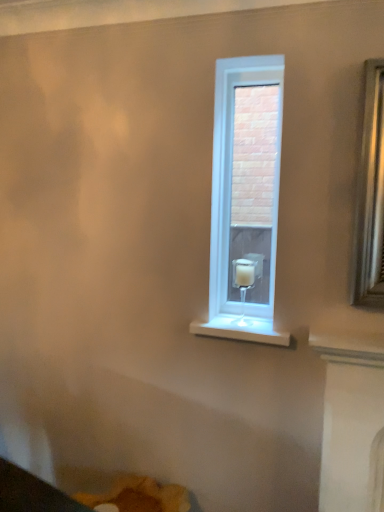
The height and width of the screenshot is (512, 384). What do you see at coordinates (245, 199) in the screenshot?
I see `white glass window at center` at bounding box center [245, 199].

Locate an element on the screen. The height and width of the screenshot is (512, 384). white glass window at center is located at coordinates (245, 199).

What do you see at coordinates (243, 284) in the screenshot? I see `white glass candle holder at center` at bounding box center [243, 284].

Locate an element on the screen. This screenshot has height=512, width=384. white glass candle holder at center is located at coordinates (243, 284).

What is the approximate height of white glass candle holder at center?

It is 10.20 inches.

Locate an element on the screen. Image resolution: width=384 pixels, height=512 pixels. white glass window at center is located at coordinates (245, 199).

Can you confirm if white glass candle holder at center is positioned to the left of white glass window at center?

Indeed, white glass candle holder at center is positioned on the left side of white glass window at center.

From the picture: Considering their positions, is white glass candle holder at center located in front of or behind white glass window at center?

white glass candle holder at center is in front of white glass window at center.

Between point (241, 305) and point (272, 282), which one is positioned behind?

The point (241, 305) is farther from the camera.

From the image's perspective, relative to white glass window at center, is white glass candle holder at center above or below?

Clearly, from the image's perspective, white glass candle holder at center is below white glass window at center.

From a real-world perspective, is white glass candle holder at center positioned under white glass window at center based on gravity?

Yes, from a real-world perspective, white glass candle holder at center is below white glass window at center.

Looking at this image, considering the relative sizes of white glass candle holder at center and white glass window at center in the image provided, is white glass candle holder at center wider than white glass window at center?

Indeed, white glass candle holder at center has a greater width compared to white glass window at center.

Is white glass candle holder at center shorter than white glass window at center?

Yes, white glass candle holder at center is shorter than white glass window at center.

Considering the relative sizes of white glass candle holder at center and white glass window at center in the image provided, is white glass candle holder at center smaller than white glass window at center?

Yes.

Can we say white glass candle holder at center lies outside white glass window at center?

white glass candle holder at center lies outside white glass window at center's area.

Is white glass candle holder at center far from white glass window at center?

Absolutely, white glass candle holder at center is distant from white glass window at center.

Is white glass candle holder at center looking in the opposite direction of white glass window at center?

Yes, white glass candle holder at center is facing away from white glass window at center.

Measure the distance between white glass candle holder at center and white glass window at center.

A distance of 4.22 feet exists between white glass candle holder at center and white glass window at center.

At what (x,y) coordinates should I click in order to perform the action: click on window that appears behind the white glass candle holder at center. Please return your answer as a coordinate pair (x, y). The height and width of the screenshot is (512, 384). Looking at the image, I should click on (245, 199).

Considering the relative positions of white glass window at center and white glass candle holder at center in the image provided, is white glass window at center to the left of white glass candle holder at center from the viewer's perspective?

No.

Does white glass window at center come behind white glass candle holder at center?

Yes.

Which point is more distant from viewer, (x=236, y=222) or (x=247, y=275)?

Positioned behind is point (x=236, y=222).

From the image's perspective, which one is positioned lower, white glass window at center or white glass candle holder at center?

white glass candle holder at center is shown below in the image.

From a real-world perspective, is white glass window at center on white glass candle holder at center?

Indeed, from a real-world perspective, white glass window at center stands above white glass candle holder at center.

Considering the relative sizes of white glass window at center and white glass candle holder at center in the image provided, is white glass window at center wider than white glass candle holder at center?

No.

Considering the sizes of objects white glass window at center and white glass candle holder at center in the image provided, who is shorter, white glass window at center or white glass candle holder at center?

white glass candle holder at center is shorter.

Between white glass window at center and white glass candle holder at center, which one has smaller size?

white glass candle holder at center.

Is white glass window at center outside of white glass candle holder at center?

Yes.

Consider the image. Is white glass window at center touching white glass candle holder at center?

No, white glass window at center is not next to white glass candle holder at center.

Is white glass window at center positioned with its back to white glass candle holder at center?

Yes, white glass window at center is facing away from white glass candle holder at center.

How different are the orientations of white glass window at center and white glass candle holder at center in degrees?

The facing directions of white glass window at center and white glass candle holder at center are 1.71 degrees apart.

You are a GUI agent. You are given a task and a screenshot of the screen. Output one action in this format:
    pyautogui.click(x=<x>, y=<y>)
    Task: Click on the window above the white glass candle holder at center (from a real-world perspective)
    This screenshot has height=512, width=384.
    Given the screenshot: What is the action you would take?
    (245, 199)

This screenshot has height=512, width=384. I want to click on candle holder located in front of the white glass window at center, so click(x=243, y=284).

Locate an element on the screen. The image size is (384, 512). window above the white glass candle holder at center (from the image's perspective) is located at coordinates (245, 199).